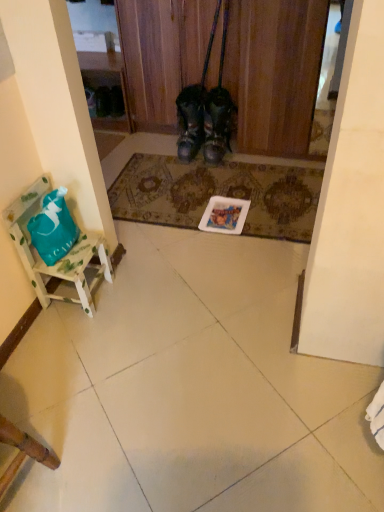
Question: In the image, is white wood chair at left on the left side or the right side of leather boots at center, which is the second footwear from left to right?

Choices:
 (A) right
 (B) left

Answer: (B)

Question: From the image's perspective, relative to leather boots at center, which is the second footwear from left to right, is white wood chair at left above or below?

Choices:
 (A) below
 (B) above

Answer: (A)

Question: Estimate the real-world distances between objects in this image. Which object is closer to the wooden chair at lower left?

Choices:
 (A) leather boots at center, the first footwear viewed from the left
 (B) leather boots at center, which is the second footwear from left to right
 (C) black leather boots at center
 (D) white wood chair at left
 (E) patterned carpet at center

Answer: (D)

Question: Which is nearer to the patterned carpet at center?

Choices:
 (A) leather boots at center, the first footwear viewed from the left
 (B) black leather boots at center
 (C) white wood chair at left
 (D) leather boots at center, which is the second footwear from left to right
 (E) wooden chair at lower left

Answer: (D)